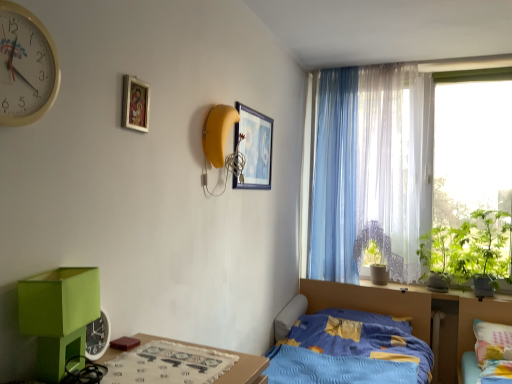
Question: Based on their positions, is wooden table at lower left located to the left or right of blue quilted bed at center, the first bed in the left-to-right sequence?

Choices:
 (A) left
 (B) right

Answer: (A)

Question: In the image, is wooden table at lower left positioned in front of or behind blue quilted bed at center, the first bed in the left-to-right sequence?

Choices:
 (A) behind
 (B) front

Answer: (B)

Question: Which object is positioned closest to the green leafy plant at window, which is the second plant from left to right?

Choices:
 (A) multicolored fabric bed at lower right, the 1th bed positioned from the right
 (B) green matte changing table at lower left
 (C) light blue sheer curtain at center, the 2th curtain from the right
 (D) wooden picture frame at upper center, positioned as the 2th picture frame in front-to-back order
 (E) blue quilted bed at center, positioned as the 2th bed in right-to-left order

Answer: (A)

Question: Which object is the closest to the wooden picture frame at upper center, which appears as the 1th picture frame when viewed from the right?

Choices:
 (A) multicolored fabric bed at lower right, the 1th bed positioned from the right
 (B) blue quilted bed at center, the first bed in the left-to-right sequence
 (C) light blue sheer curtain at center, the 2th curtain from the right
 (D) wooden table at lower left
 (E) green matte changing table at lower left

Answer: (C)